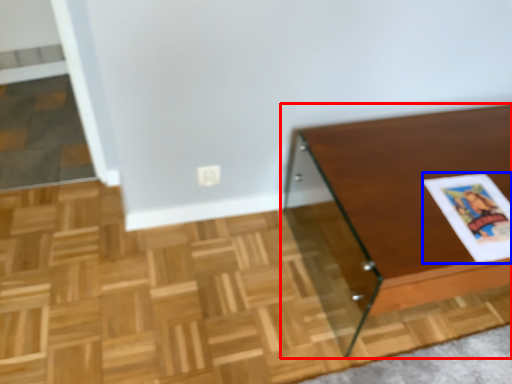
Question: Which object appears farthest to the camera in this image, table (highlighted by a red box) or magazine (highlighted by a blue box)?

Choices:
 (A) table
 (B) magazine

Answer: (B)